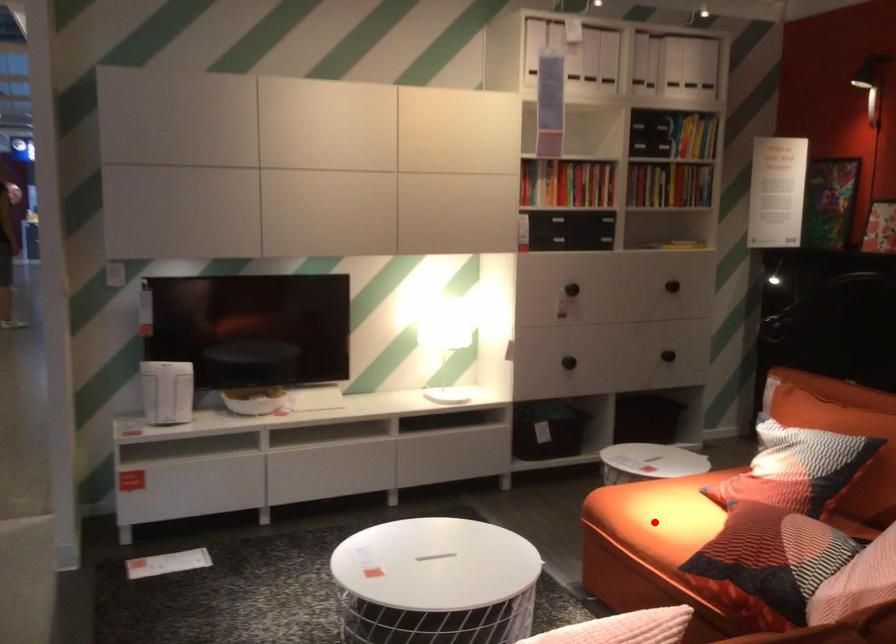
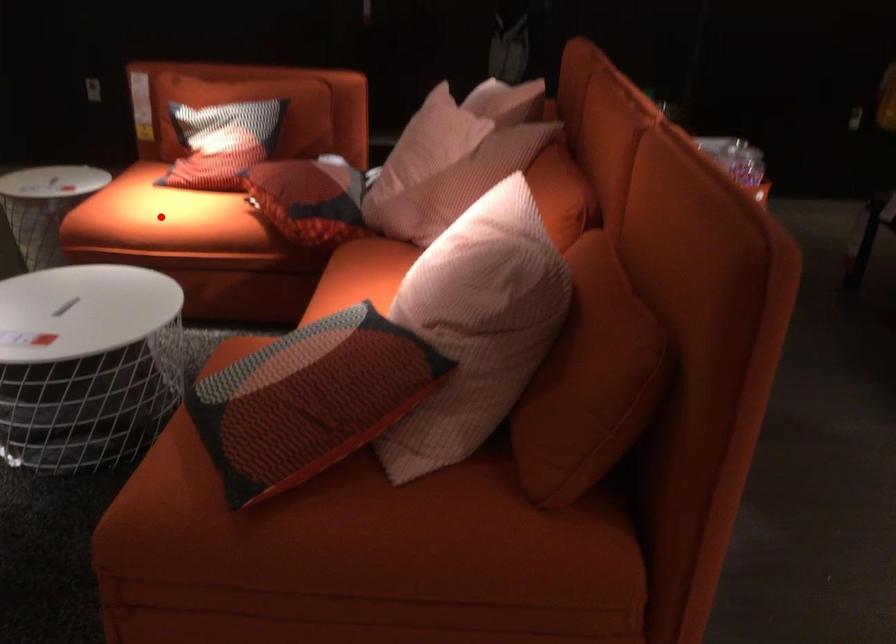
I am providing you with two images of the same scene from different viewpoints. A red point is marked on the first image and another point is marked on the second image. Do the highlighted points in image1 and image2 indicate the same real-world spot?

Yes